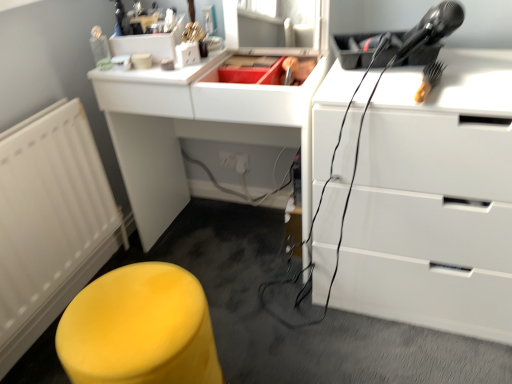
The height and width of the screenshot is (384, 512). What are the coordinates of `free space in front of white glossy computer desk at center` in the screenshot? It's located at (289, 329).